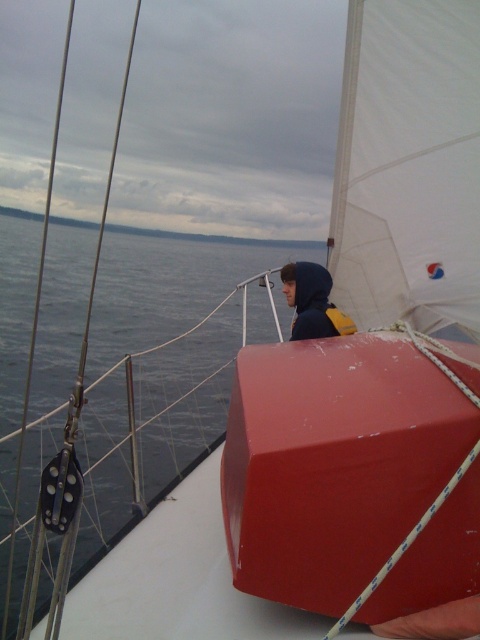
You are a sailor on the boat and need to retrieve the matte red box at center. Where should you look first based on its position relative to the matte black hoodie at center?

The matte red box at center is positioned under the matte black hoodie at center, so you should look underneath the matte black hoodie at center to find it.

Based on the photo, you are standing on the deck of the sailboat and notice a point marked at coordinates (354, 474). What object is located at that specific coordinate?

The object located at point (354, 474) is a matte red box at center.

You are standing on the deck of the sailboat and want to reach the point marked at coordinates point (472, 577). If your reach extends 1.5 meters, will you be able to touch that point without moving your feet?

The distance of point (472, 577) from the camera is 1.64 meters, which is beyond your 1.5 meter reach. Therefore, you cannot touch the point without moving your feet.